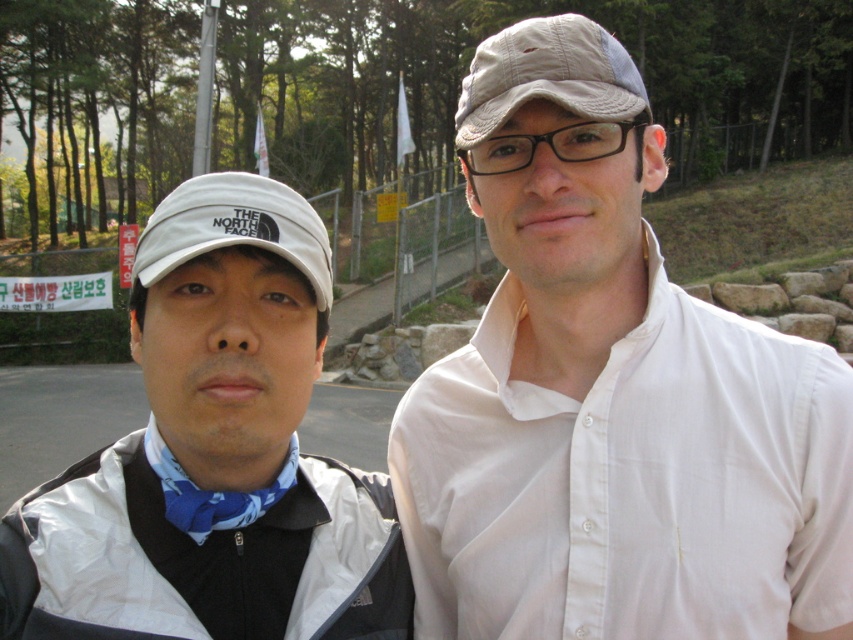
You are a photographer setting up a camera to take a portrait of two people wearing tan fabric cap at upper center and white fabric baseball hat at left. The camera has a minimum focusing distance of 20 inches. Will you need to adjust the camera position to ensure both subjects are in focus?

The tan fabric cap at upper center is 19.76 inches away from the white fabric baseball hat at left. Since the minimum focusing distance is 20 inches, the camera cannot focus on both subjects at this distance. You will need to move closer to ensure both are in focus.

Based on the photo, you are standing at the center of the image. Which direction should you look to see the white fabric cap at left?

You should look to the left to see the white fabric cap at left because it is positioned at the left side of the image.

You are a photographer trying to capture a photo of the white matte shirt at center and the white fabric cap at left. Which object should you focus on first if you want to ensure both are in focus without moving the camera?

The white fabric cap at left is closer to the camera than the white matte shirt at center. To ensure both are in focus, you should focus on the white fabric cap at left first since it is closer, and the depth of field may extend to the shirt if focused there.